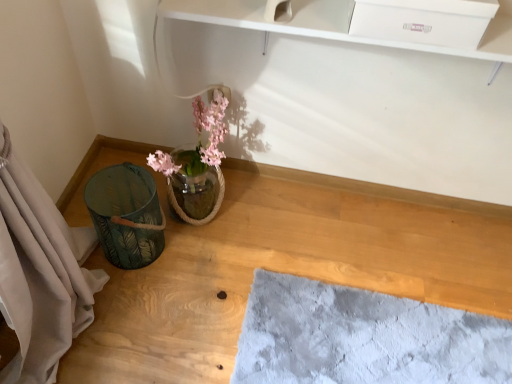
Locate an element on the screen. Image resolution: width=512 pixels, height=384 pixels. vacant space to the right of green leaf-patterned basket at left is located at coordinates (201, 270).